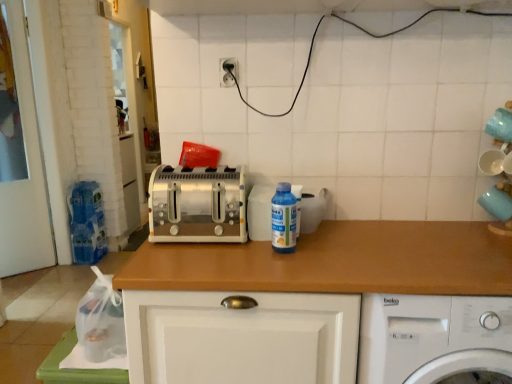
Locate an element on the screen. The width and height of the screenshot is (512, 384). vacant area that lies in front of transparent plastic bottle at center is located at coordinates (293, 261).